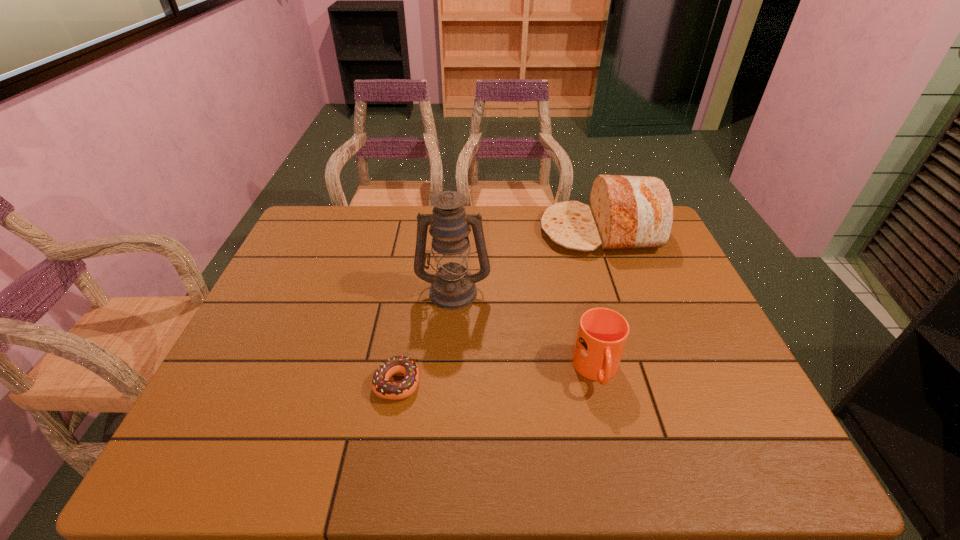
This screenshot has width=960, height=540. What are the coordinates of `free point between the third nearest object and the mug` in the screenshot? It's located at (525, 331).

Find the location of a particular element. The image size is (960, 540). vacant space that's between the doughnut and the second shortest object is located at coordinates (497, 376).

This screenshot has height=540, width=960. What are the coordinates of `free space that is in between the third tallest object and the shortest object` in the screenshot? It's located at (497, 376).

Image resolution: width=960 pixels, height=540 pixels. Find the location of `free space between the farthest object and the tallest object`. free space between the farthest object and the tallest object is located at coordinates (527, 261).

What are the coordinates of `vacant space that is in between the shortest object and the mug` in the screenshot? It's located at (497, 376).

You are a GUI agent. You are given a task and a screenshot of the screen. Output one action in this format:
    pyautogui.click(x=<x>, y=<y>)
    Task: Click on the empty location between the doughnut and the third nearest object
    This screenshot has height=540, width=960.
    Given the screenshot: What is the action you would take?
    pyautogui.click(x=425, y=336)

The height and width of the screenshot is (540, 960). I want to click on free spot between the doughnut and the oil lamp, so click(425, 336).

Where is `vacant point located between the farthest object and the second shortest object`? The image size is (960, 540). vacant point located between the farthest object and the second shortest object is located at coordinates (598, 301).

What are the coordinates of `free area in between the mug and the bread` in the screenshot? It's located at (x=598, y=301).

Find the location of a particular element. Image resolution: width=960 pixels, height=540 pixels. free space between the second tallest object and the shortest object is located at coordinates (498, 307).